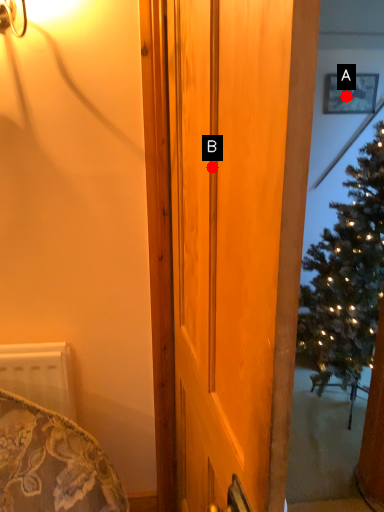
Question: Two points are circled on the image, labeled by A and B beside each circle. Among these points, which one is nearest to the camera?

Choices:
 (A) A is closer
 (B) B is closer

Answer: (B)